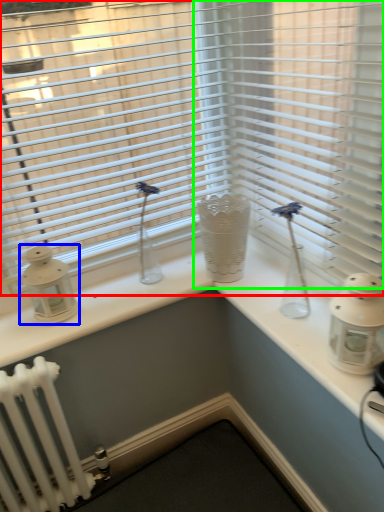
Question: Which is nearer to the window blind (highlighted by a red box)? candle holder (highlighted by a blue box) or blind (highlighted by a green box).

Choices:
 (A) candle holder
 (B) blind

Answer: (B)